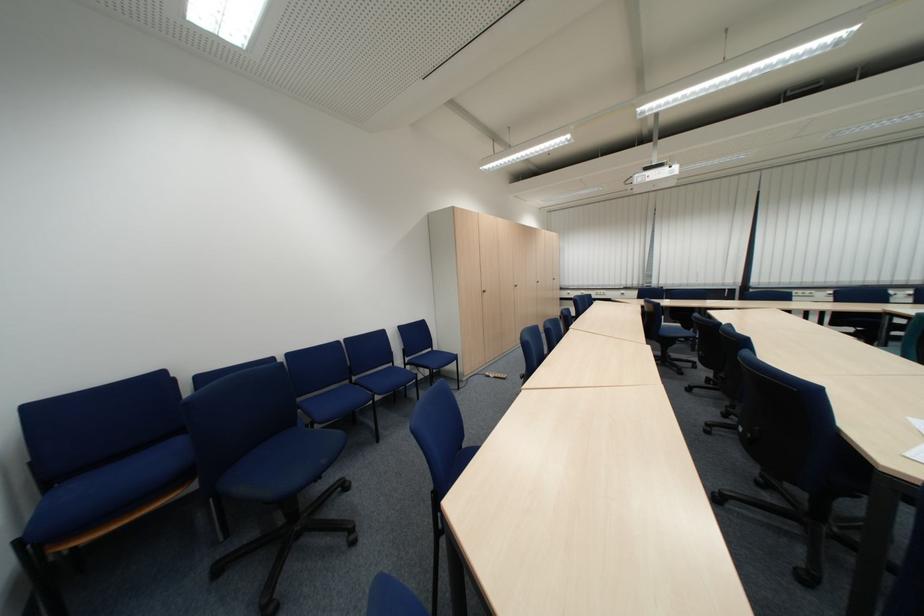
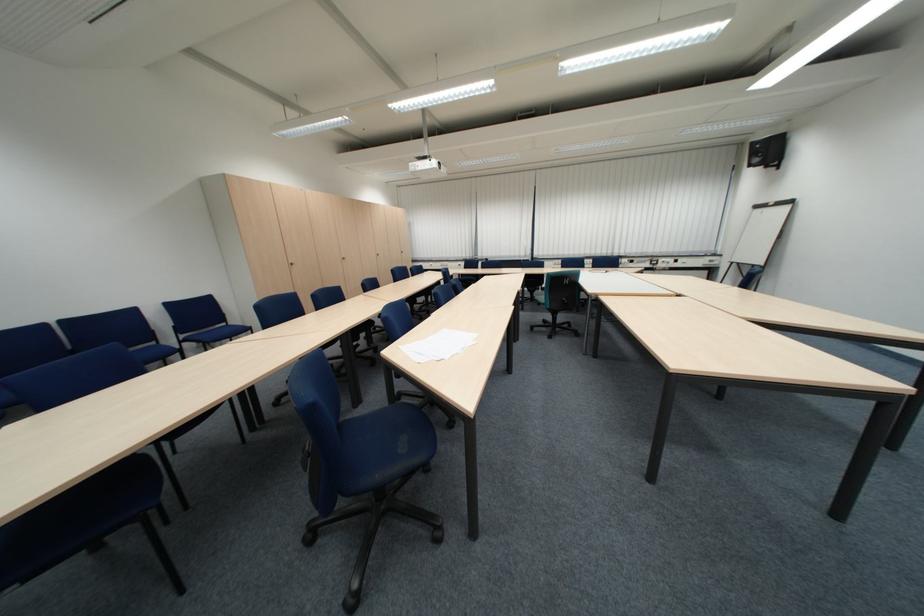
Locate, in the second image, the point that corresponds to point 444,351 in the first image.

(237, 326)